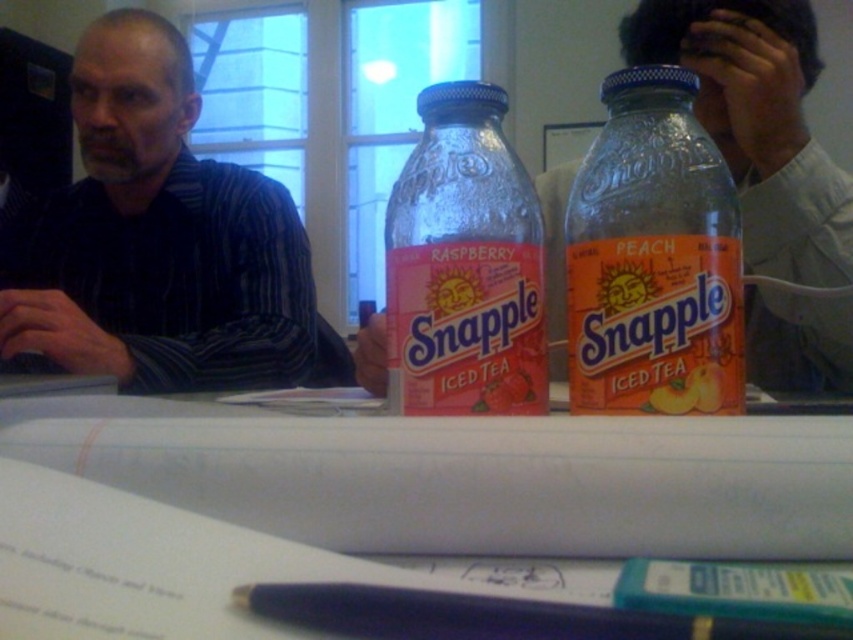
From the picture: Is striped shirt at left further to the viewer compared to smooth peach snapple iced tea bottle at center?

→ Yes, striped shirt at left is behind smooth peach snapple iced tea bottle at center.

This screenshot has width=853, height=640. What do you see at coordinates (160, 241) in the screenshot? I see `striped shirt at left` at bounding box center [160, 241].

Is point (167, 289) positioned before point (761, 326)?

That is False.

At what (x,y) coordinates should I click in order to perform the action: click on striped shirt at left. Please return your answer as a coordinate pair (x, y). Looking at the image, I should click on (160, 241).

In the scene shown: Is white paper at center below striped shirt at left?

Yes.

Can you confirm if white paper at center is bigger than striped shirt at left?

Actually, white paper at center might be smaller than striped shirt at left.

Between point (604, 556) and point (172, 54), which one is positioned in front?

Point (604, 556) is more forward.

Where is `white paper at center`? white paper at center is located at coordinates (466, 476).

Who is positioned more to the right, white paper at center or clear glass bottle at center?

Positioned to the right is clear glass bottle at center.

Who is more forward, (x=102, y=397) or (x=660, y=93)?

Point (x=102, y=397) is in front.

Find the location of `white paper at center`. white paper at center is located at coordinates (466, 476).